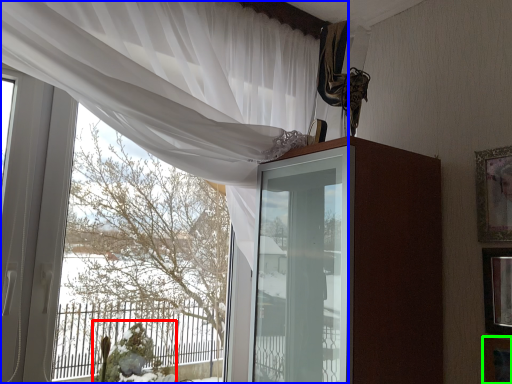
Question: Based on their relative distances, which object is farther from floral arrangement (highlighted by a red box)? Choose from curtain (highlighted by a blue box) and picture frame (highlighted by a green box).

Choices:
 (A) curtain
 (B) picture frame

Answer: (B)